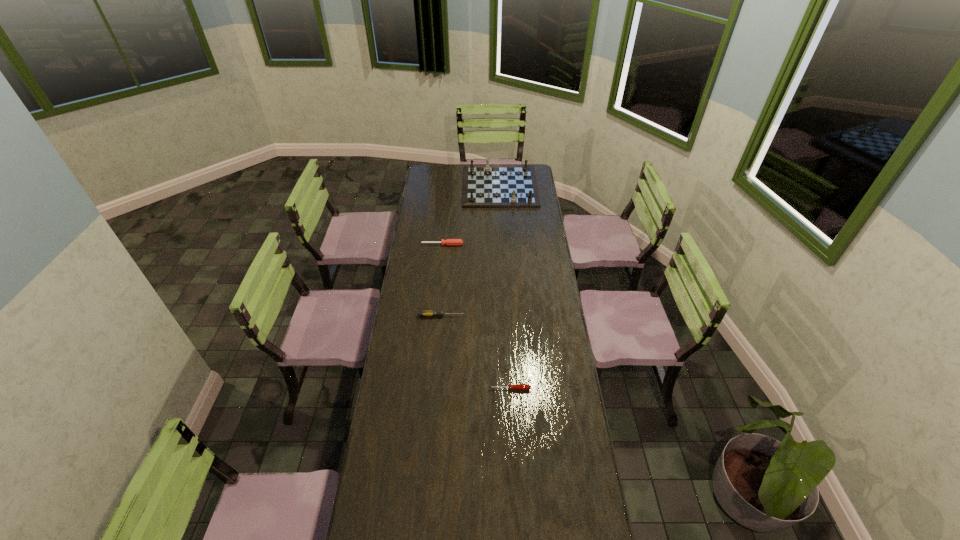
Find the location of `empty location between the second farthest screwdriver and the farthest object`. empty location between the second farthest screwdriver and the farthest object is located at coordinates (470, 251).

Where is `free space that is in between the second farthest screwdriver and the nearest object`? free space that is in between the second farthest screwdriver and the nearest object is located at coordinates (475, 352).

Where is `free spot between the second farthest object and the nearest object`? The width and height of the screenshot is (960, 540). free spot between the second farthest object and the nearest object is located at coordinates (476, 316).

In order to click on vacant region between the rightmost screwdriver and the second nearest object in this screenshot , I will do `click(475, 352)`.

Locate an element on the screen. free spot between the chessboard and the farthest screwdriver is located at coordinates (471, 215).

At what (x,y) coordinates should I click in order to perform the action: click on free space between the farthest object and the third nearest object. Please return your answer as a coordinate pair (x, y). Looking at the image, I should click on (471, 215).

Identify the location of vacant space in between the rightmost screwdriver and the third farthest object. click(475, 352).

Where is `the closest object to the rightmost screwdriver`? The height and width of the screenshot is (540, 960). the closest object to the rightmost screwdriver is located at coordinates (422, 313).

Image resolution: width=960 pixels, height=540 pixels. What are the coordinates of `object that is the closest to the chessboard` in the screenshot? It's located at (449, 241).

Select which screwdriver appears as the second closest to the nearest screwdriver. Please provide its 2D coordinates. Your answer should be formatted as a tuple, i.e. [(x, y)], where the tuple contains the x and y coordinates of a point satisfying the conditions above.

[(449, 241)]